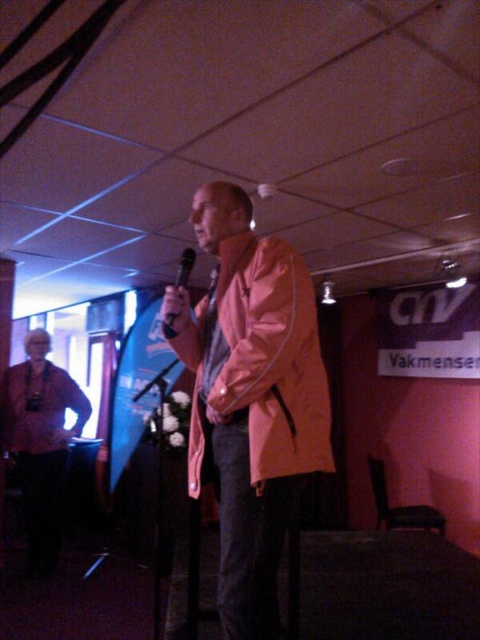
Is point (269, 522) less distant than point (183, 275)?

Yes, point (269, 522) is in front of point (183, 275).

Who is higher up, orange matte jacket at center or black matte microphone at center?

Positioned higher is black matte microphone at center.

Which is in front, point (314, 468) or point (178, 268)?

Point (314, 468) is more forward.

Locate an element on the screen. orange matte jacket at center is located at coordinates (250, 397).